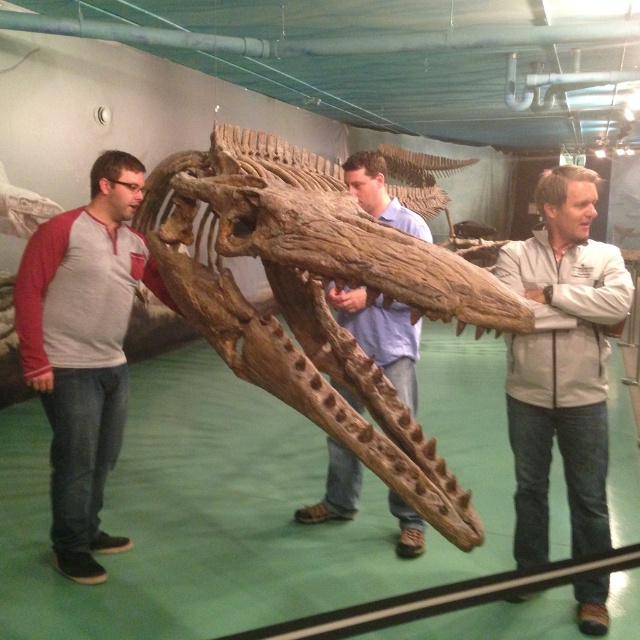
You are standing in a museum looking at the dinosaur skeleton. There are two points marked on the skeleton, one at coordinates point (220, 342) and the other at point (381, 356). Which point is closer to you?

Point (220, 342) is closer to the viewer than point (381, 356).